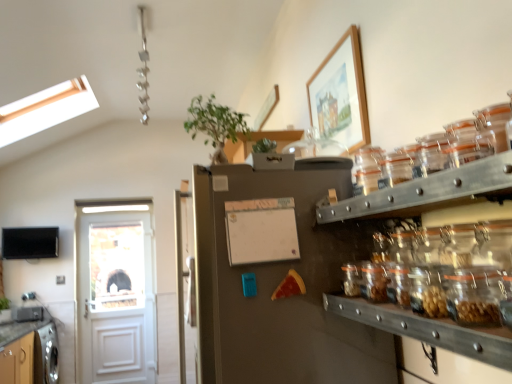
This screenshot has height=384, width=512. I want to click on white matte cabinet at upper center, which ranks as the 2th cabinetry in back-to-front order, so click(257, 140).

Measure the distance between point (247,150) and camera.

They are 1.78 meters apart.

Find the location of a particular element. This screenshot has height=384, width=512. wooden picture frame at upper center is located at coordinates (340, 94).

Where is `matte wood cabinet at lower left, the 1th cabinetry positioned from the bottom`? matte wood cabinet at lower left, the 1th cabinetry positioned from the bottom is located at coordinates (18, 361).

Between point (359, 100) and point (206, 223), which one is positioned in front?

The point (206, 223) is closer.

From a real-world perspective, is wooden picture frame at upper center above or below satin silver fridge at center?

From a real-world perspective, wooden picture frame at upper center is physically above satin silver fridge at center.

Is wooden picture frame at upper center not inside satin silver fridge at center?

wooden picture frame at upper center is positioned outside satin silver fridge at center.

Which object is positioned more to the left, white wooden door at left or white matte bulletin board at center?

white wooden door at left.

I want to click on door that appears below the white matte bulletin board at center (from the image's perspective), so click(x=115, y=291).

Considering the relative positions of white wooden door at left and white matte bulletin board at center in the image provided, is white wooden door at left behind white matte bulletin board at center?

Yes, the depth of white wooden door at left is greater than that of white matte bulletin board at center.

Looking at this image, can you confirm if white wooden door at left is bigger than white matte bulletin board at center?

Yes.

From the image's perspective, is white matte cabinet at upper center, which is the first cabinetry in top-to-bottom order, positioned above or below satin silver fridge at center?

white matte cabinet at upper center, which is the first cabinetry in top-to-bottom order, is situated higher than satin silver fridge at center in the image.

Considering the positions of objects white matte cabinet at upper center, which ranks as the 2th cabinetry in back-to-front order, and satin silver fridge at center in the image provided, who is in front, white matte cabinet at upper center, which ranks as the 2th cabinetry in back-to-front order, or satin silver fridge at center?

satin silver fridge at center is closer to the camera.

Identify the location of fridge beneath the white matte cabinet at upper center, which is the first cabinetry in top-to-bottom order (from a real-world perspective). (279, 284).

From the image's perspective, which one is positioned lower, clear glass jars at center right or white wooden door at left?

white wooden door at left.

Considering their positions, is clear glass jars at center right located in front of or behind white wooden door at left?

clear glass jars at center right is in front of white wooden door at left.

Identify the location of door below the clear glass jars at center right (from a real-world perspective). This screenshot has height=384, width=512. (115, 291).

Which is more to the right, clear glass jars at center right or white wooden door at left?

From the viewer's perspective, clear glass jars at center right appears more on the right side.

From a real-world perspective, between satin silver fridge at center and white matte cabinet at upper center, which appears as the first cabinetry when viewed from the right, who is vertically lower?

From a 3D spatial view, satin silver fridge at center is below.

Could you tell me if satin silver fridge at center is facing white matte cabinet at upper center, which appears as the first cabinetry when viewed from the right?

No.

Is satin silver fridge at center to the right of white matte cabinet at upper center, the 2th cabinetry in the left-to-right sequence, from the viewer's perspective?

Incorrect, satin silver fridge at center is not on the right side of white matte cabinet at upper center, the 2th cabinetry in the left-to-right sequence.

From the image's perspective, is satin silver fridge at center beneath white matte cabinet at upper center, which is the 1th cabinetry from front to back?

Correct, satin silver fridge at center appears lower than white matte cabinet at upper center, which is the 1th cabinetry from front to back, in the image.

Is flat screen tv at left not near white wooden door at left?

No, flat screen tv at left is not far from white wooden door at left.

Which is more to the right, flat screen tv at left or white wooden door at left?

Positioned to the right is white wooden door at left.

Considering the positions of objects flat screen tv at left and white wooden door at left in the image provided, who is behind, flat screen tv at left or white wooden door at left?

Positioned behind is white wooden door at left.

Is flat screen tv at left taller or shorter than white wooden door at left?

Clearly, flat screen tv at left is shorter compared to white wooden door at left.

Is matte wood cabinet at lower left, placed as the 2th cabinetry when sorted from right to left, aimed at green leafy plant at upper center?

No, matte wood cabinet at lower left, placed as the 2th cabinetry when sorted from right to left, is not oriented towards green leafy plant at upper center.

Is matte wood cabinet at lower left, the 1th cabinetry positioned from the bottom, not close to green leafy plant at upper center?

Yes, matte wood cabinet at lower left, the 1th cabinetry positioned from the bottom, and green leafy plant at upper center are located far from each other.

Is matte wood cabinet at lower left, the 1th cabinetry positioned from the bottom, shorter than green leafy plant at upper center?

No.

The width and height of the screenshot is (512, 384). What are the coordinates of `picture frame that is on the right side of satin silver fridge at center` in the screenshot? It's located at (340, 94).

Where is `door beneath the white matte bulletin board at center (from a real-world perspective)`? This screenshot has width=512, height=384. door beneath the white matte bulletin board at center (from a real-world perspective) is located at coordinates (115, 291).

From the image, which object appears to be nearer to matte wood cabinet at lower left, which is the 2th cabinetry from top to bottom, flat screen tv at left or clear glass jars at center right?

Among the two, flat screen tv at left is located nearer to matte wood cabinet at lower left, which is the 2th cabinetry from top to bottom.

From the image, which object appears to be farther from translucent glass jar at right, satin silver fridge at center or white matte cabinet at upper center, which is the first cabinetry in top-to-bottom order?

white matte cabinet at upper center, which is the first cabinetry in top-to-bottom order, is positioned further to the anchor translucent glass jar at right.

Looking at this image, considering their positions, is translucent glass jar at right positioned further to satin silver fridge at center than green leafy plant at upper center?

translucent glass jar at right lies further to satin silver fridge at center than the other object.

Looking at the image, which one is located closer to white wooden door at left, white matte cabinet at upper center, which is the 1th cabinetry from front to back, or clear glass jars at center right?

white matte cabinet at upper center, which is the 1th cabinetry from front to back, is closer to white wooden door at left.

Estimate the real-world distances between objects in this image. Which object is closer to white matte bulletin board at center, white matte cabinet at upper center, the 2th cabinetry in the left-to-right sequence, or clear glass jars at center right?

clear glass jars at center right.

When comparing their distances from satin silver fridge at center, does translucent glass jar at right or matte wood cabinet at lower left, the first cabinetry from the left, seem further?

matte wood cabinet at lower left, the first cabinetry from the left.

Which object lies further to the anchor point white matte cabinet at upper center, which ranks as the 2th cabinetry in back-to-front order, white wooden door at left or flat screen tv at left?

flat screen tv at left is positioned further to the anchor white matte cabinet at upper center, which ranks as the 2th cabinetry in back-to-front order.

From the picture: Estimate the real-world distances between objects in this image. Which object is closer to satin silver fridge at center, wooden picture frame at upper center or white matte bulletin board at center?

Among the two, white matte bulletin board at center is located nearer to satin silver fridge at center.

Where is `bulletin board positioned between clear glass jars at center right and green leafy plant at upper center from near to far`? bulletin board positioned between clear glass jars at center right and green leafy plant at upper center from near to far is located at coordinates (261, 230).

Locate an element on the screen. This screenshot has height=384, width=512. bulletin board between clear glass jars at center right and flat screen tv at left along the z-axis is located at coordinates (261, 230).

Locate an element on the screen. This screenshot has width=512, height=384. cabinetry between clear glass jars at center right and green leafy plant at upper center from front to back is located at coordinates (257, 140).

You are a GUI agent. You are given a task and a screenshot of the screen. Output one action in this format:
    pyautogui.click(x=<x>, y=<y>)
    Task: Click on the cabinetry between matte wood cabinet at lower left, the 1th cabinetry positioned from the bottom, and translucent glass jar at right from left to right
    
    Given the screenshot: What is the action you would take?
    pyautogui.click(x=257, y=140)